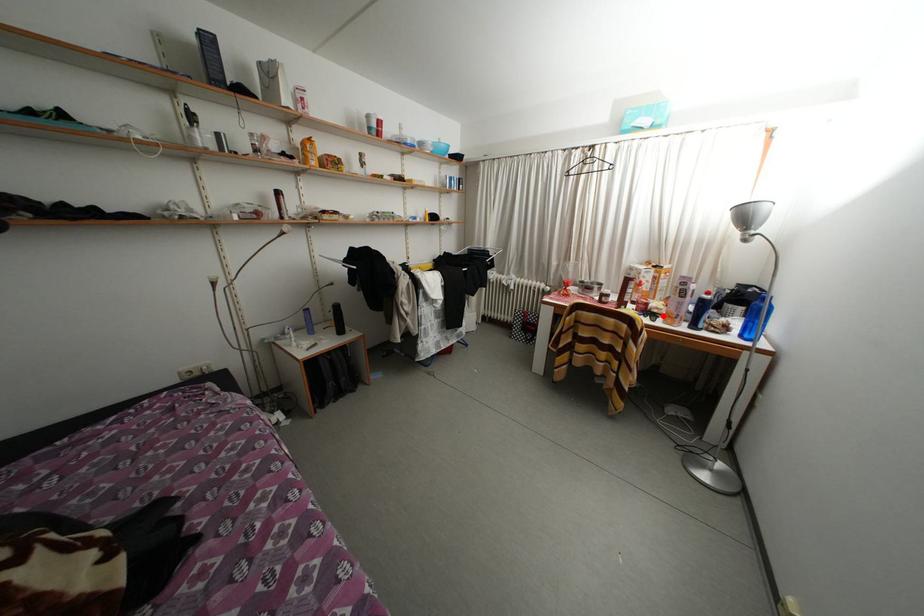
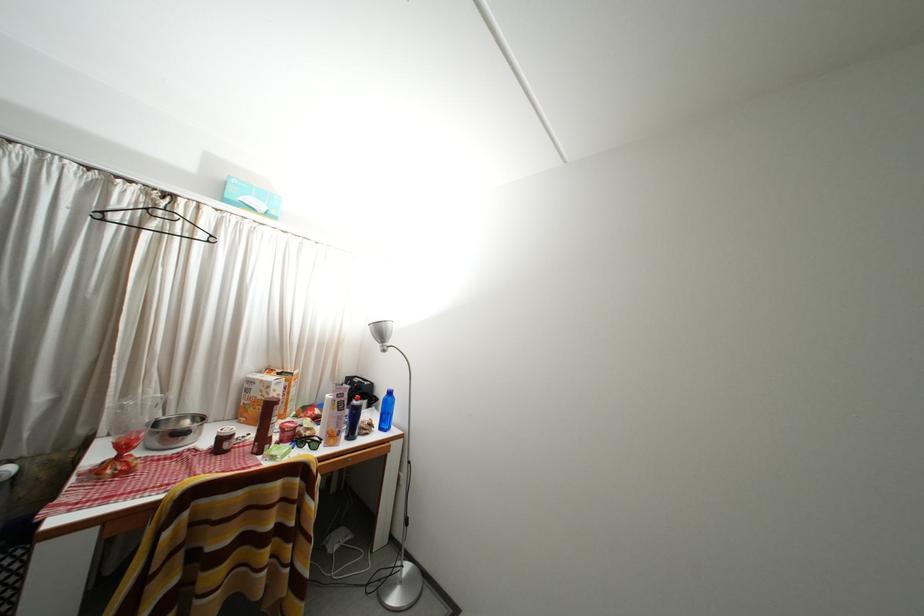
Question: I am providing you with two images of the same scene from different viewpoints. Image1 has a red point marked. In image2, the corresponding 3D location appears at what relative position? Reply with the corresponding letter.

Choices:
 (A) Closer
 (B) Farther

Answer: (B)